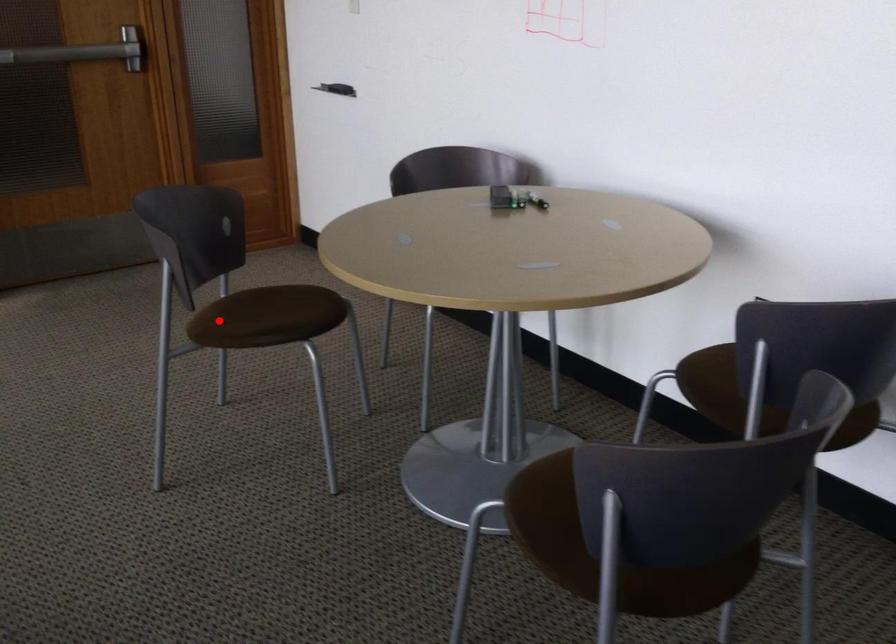
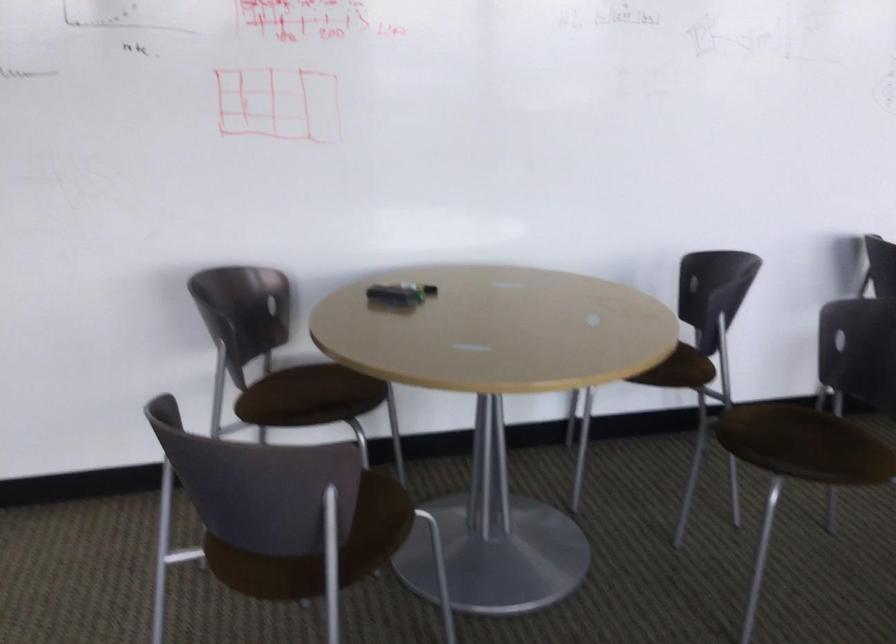
Find the pixel in the second image that matches the highlighted location in the first image.

(261, 570)